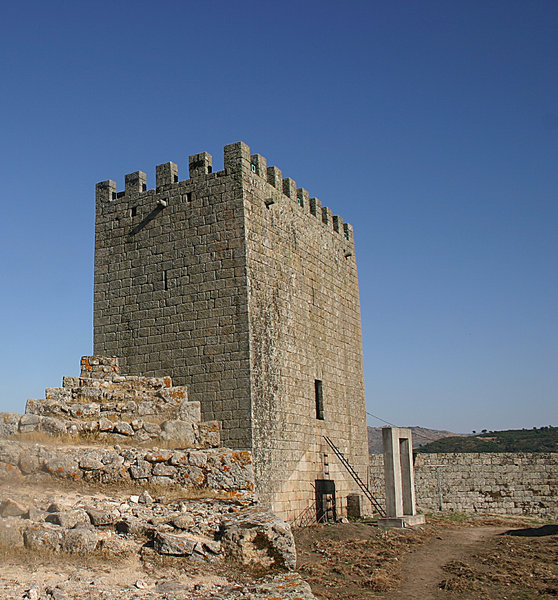
This screenshot has height=600, width=558. I want to click on ladder, so click(365, 494).